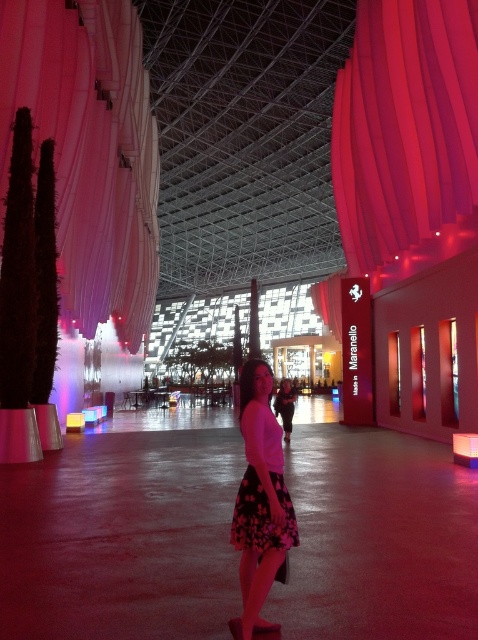
Does matte pink curtain at upper right have a smaller size compared to matte black dress at center?

Actually, matte pink curtain at upper right might be larger than matte black dress at center.

Measure the distance between matte pink curtain at upper right and camera.

10.71 meters

Locate an element on the screen. matte pink curtain at upper right is located at coordinates (404, 125).

Between point (270, 472) and point (291, 390), which one is positioned behind?

Point (291, 390)

Locate an element on the screen. This screenshot has width=478, height=640. floral cotton dress at center is located at coordinates (261, 486).

Identify the location of floral cotton dress at center. Image resolution: width=478 pixels, height=640 pixels. (261, 486).

Is white matte skirt at center above matte black dress at center?

Yes, white matte skirt at center is above matte black dress at center.

Measure the distance from white matte skirt at center to matte black dress at center.

A distance of 10.03 meters exists between white matte skirt at center and matte black dress at center.

Who is more forward, [260,577] or [291,397]?

Positioned in front is point [260,577].

Where is `white matte skirt at center`? The width and height of the screenshot is (478, 640). white matte skirt at center is located at coordinates (260, 500).